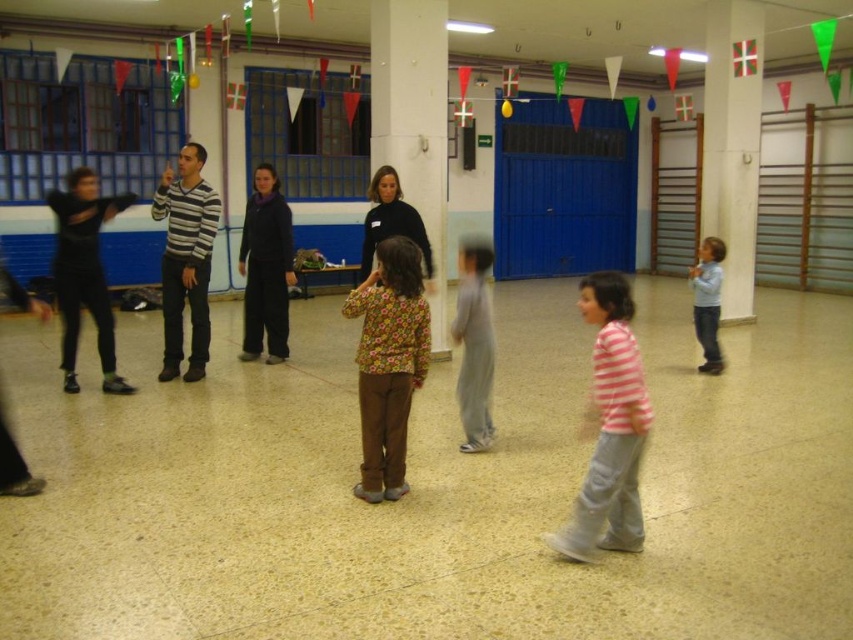
Question: Which point is closer to the camera?

Choices:
 (A) (381, 28)
 (B) (189, 200)
 (C) (695, 314)
 (D) (474, 422)

Answer: (D)

Question: Considering the real-world distances, which object is farthest from the dark blue sweater at center?

Choices:
 (A) black matte pants at left
 (B) striped sweater at center

Answer: (A)

Question: Does striped cotton shirt at center appear under floral fabric shirt at center?

Choices:
 (A) yes
 (B) no

Answer: (A)

Question: Which object is closer to the camera taking this photo?

Choices:
 (A) white concrete pillar at right
 (B) dark blue sweater at center
 (C) floral fabric shirt at center

Answer: (C)

Question: Does white glossy pillar at center appear on the right side of dark blue sweater at center?

Choices:
 (A) yes
 (B) no

Answer: (A)

Question: Does floral fabric shirt at center appear on the right side of gray cotton pants at center?

Choices:
 (A) no
 (B) yes

Answer: (A)